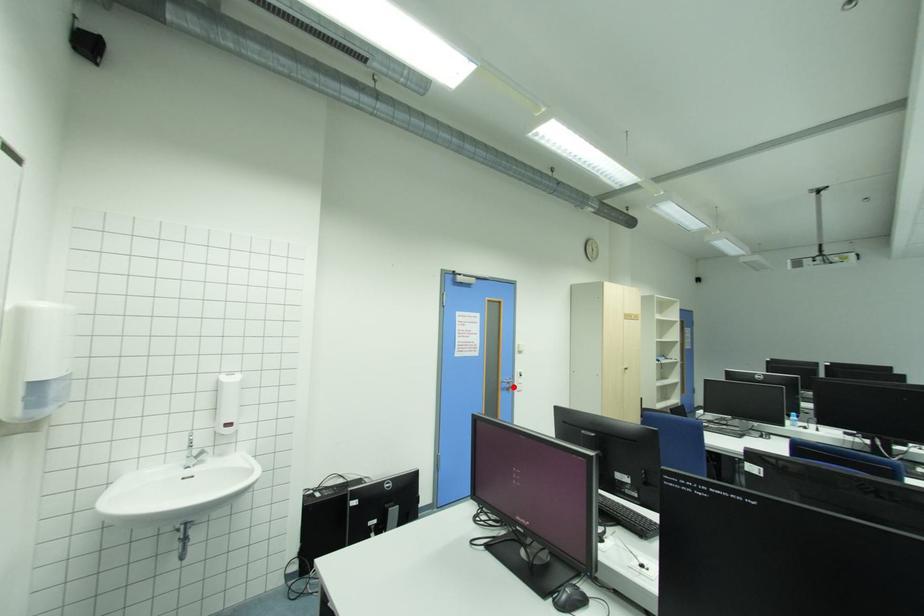
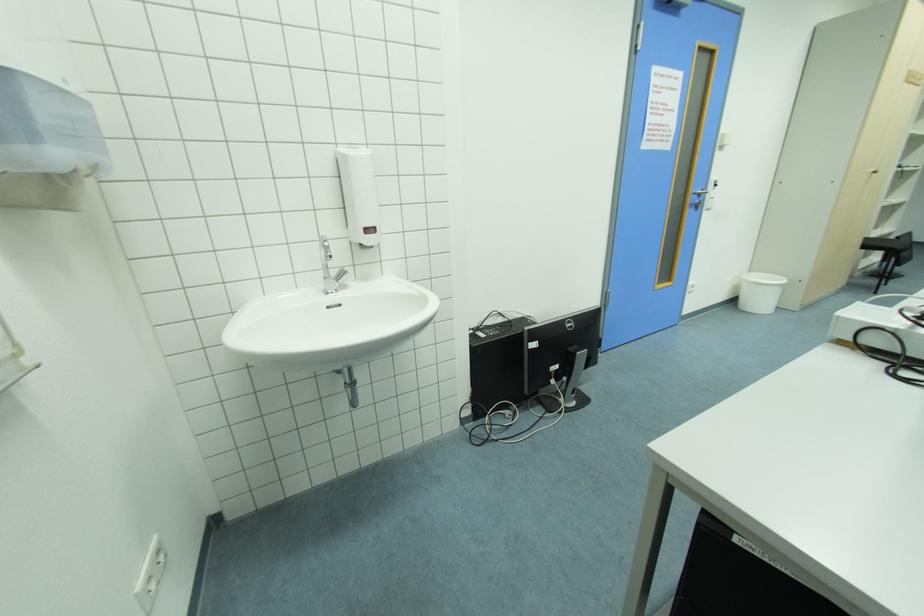
Where in the second image is the point corresponding to the highlighted location from the first image?

(702, 201)